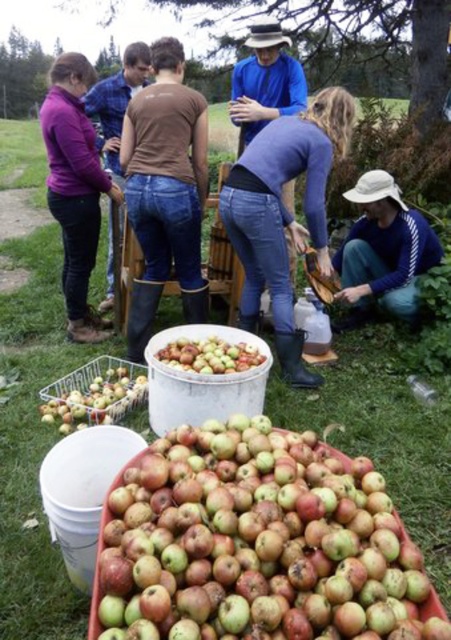
Question: Which point is farther to the camera?

Choices:
 (A) blue cotton shirt at center
 (B) matte purple sweater at left
 (C) green matte apples at lower left
 (D) white fabric hat at lower right

Answer: (A)

Question: Which point is closer to the camera?

Choices:
 (A) (240, 352)
 (B) (81, 176)
 (C) (262, 72)
 (D) (96, 419)

Answer: (D)

Question: Does white fabric hat at lower right appear over green matte apples at center?

Choices:
 (A) no
 (B) yes

Answer: (B)

Question: Which point appears closest to the camera in this image?

Choices:
 (A) tap(196, 282)
 (B) tap(253, 81)
 (C) tap(383, 193)

Answer: (A)

Question: Can you confirm if rusty metallic apples at lower center is smaller than blue jeans at center?

Choices:
 (A) no
 (B) yes

Answer: (B)

Question: Is white fabric hat at lower right bigger than blue cotton shirt at center?

Choices:
 (A) no
 (B) yes

Answer: (B)